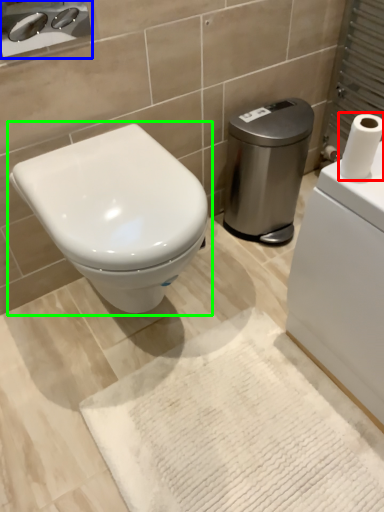
Question: Estimate the real-world distances between objects in this image. Which object is farther from toilet paper (highlighted by a red box), sink (highlighted by a blue box) or toilet (highlighted by a green box)?

Choices:
 (A) sink
 (B) toilet

Answer: (A)